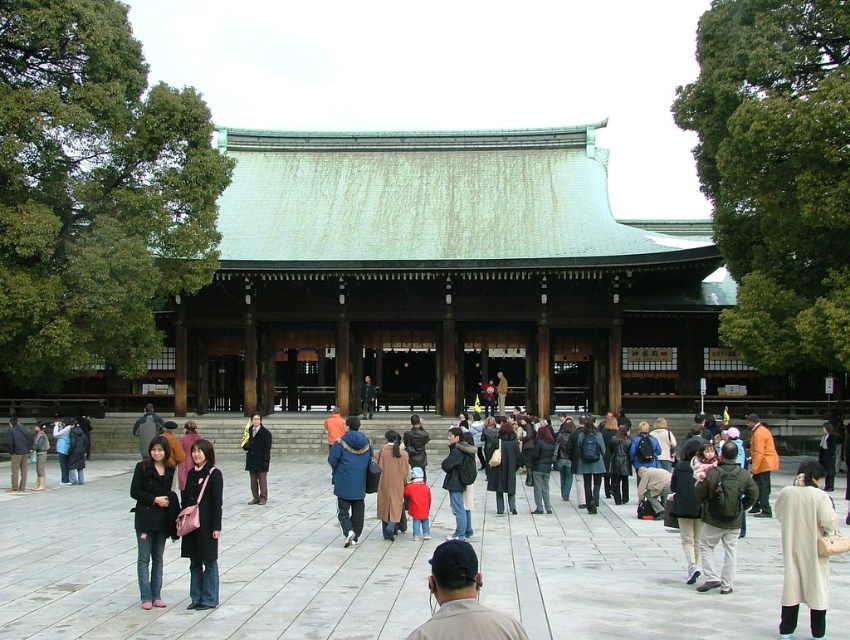
Who is positioned more to the left, dark blue jeans at center or dark brown leather coat at center?

dark brown leather coat at center is more to the left.

Which is below, dark blue jeans at center or dark brown leather coat at center?

dark blue jeans at center is below.

Between point (465, 444) and point (258, 477), which one is positioned in front?

Positioned in front is point (465, 444).

Find the location of `dark blue jeans at center`. dark blue jeans at center is located at coordinates (459, 477).

Does beige wool coat at lower right appear under dark blue jeans at center?

Actually, beige wool coat at lower right is above dark blue jeans at center.

Is beige wool coat at lower right shorter than dark blue jeans at center?

Incorrect, beige wool coat at lower right's height does not fall short of dark blue jeans at center's.

What are the coordinates of `beige wool coat at lower right` in the screenshot? It's located at (803, 548).

Who is positioned more to the left, brown wool coat at center or black wool coat at center?

brown wool coat at center

Is point (400, 438) less distant than point (514, 458)?

Yes, it is in front of point (514, 458).

In order to click on brown wool coat at center in this screenshot , I will do `click(391, 483)`.

Locate an element on the screen. brown wool coat at center is located at coordinates (391, 483).